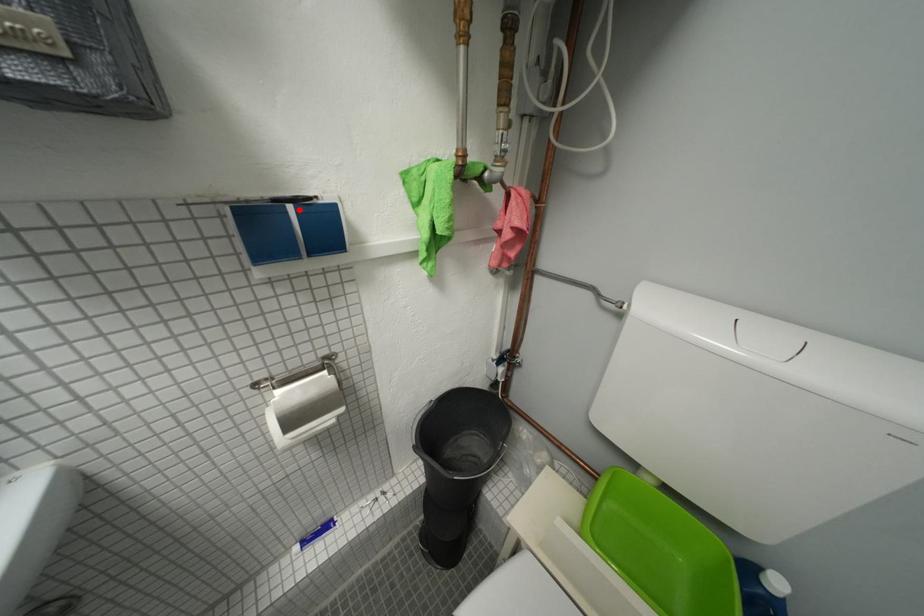
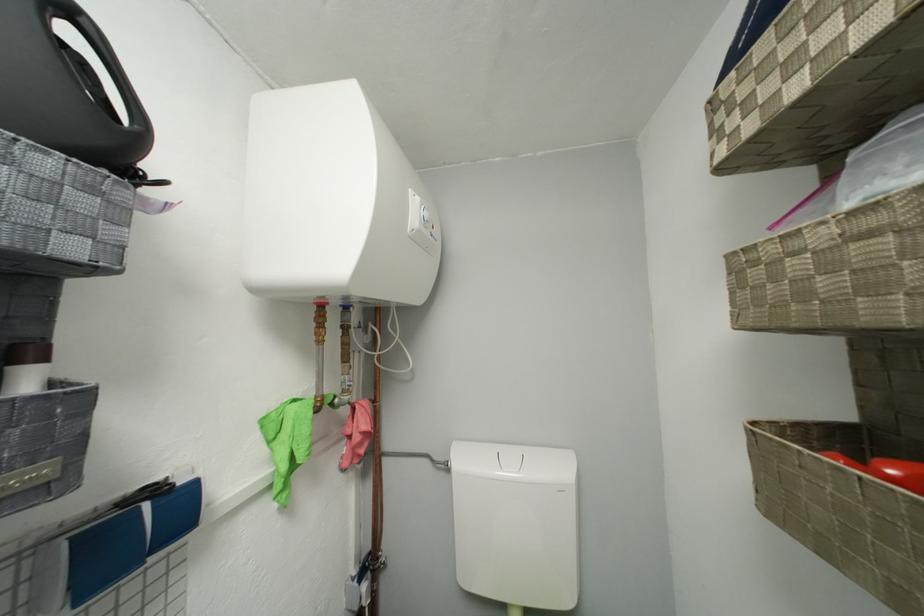
The point at the highlighted location is marked in the first image. Where is the corresponding point in the second image?

(155, 508)